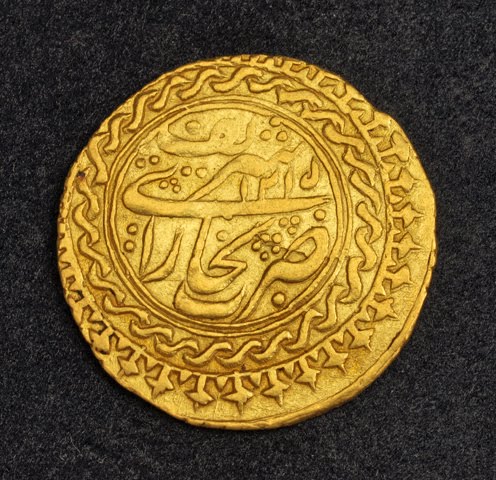
Locate an element on the screen. The width and height of the screenshot is (496, 480). grey carpet is located at coordinates (427, 425).